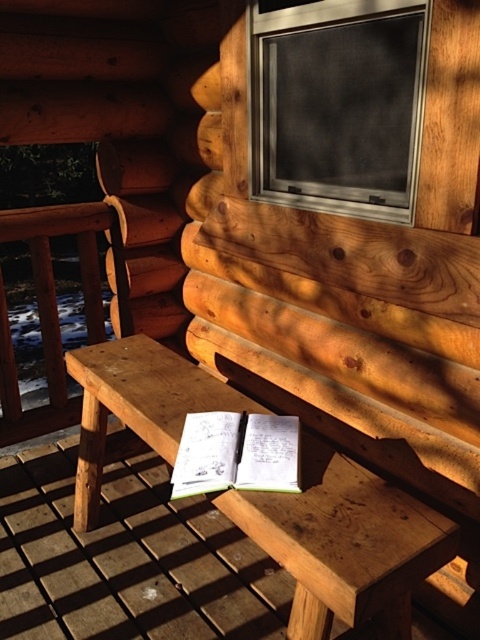
Consider the image. Is natural wood picnic table at center to the left of metallic mesh window at upper center from the viewer's perspective?

Indeed, natural wood picnic table at center is positioned on the left side of metallic mesh window at upper center.

Between point (271, 556) and point (320, 6), which one is positioned behind?

The point (320, 6) is behind.

At what (x,y) coordinates should I click in order to perform the action: click on natural wood picnic table at center. Please return your answer as a coordinate pair (x, y). Looking at the image, I should click on (345, 544).